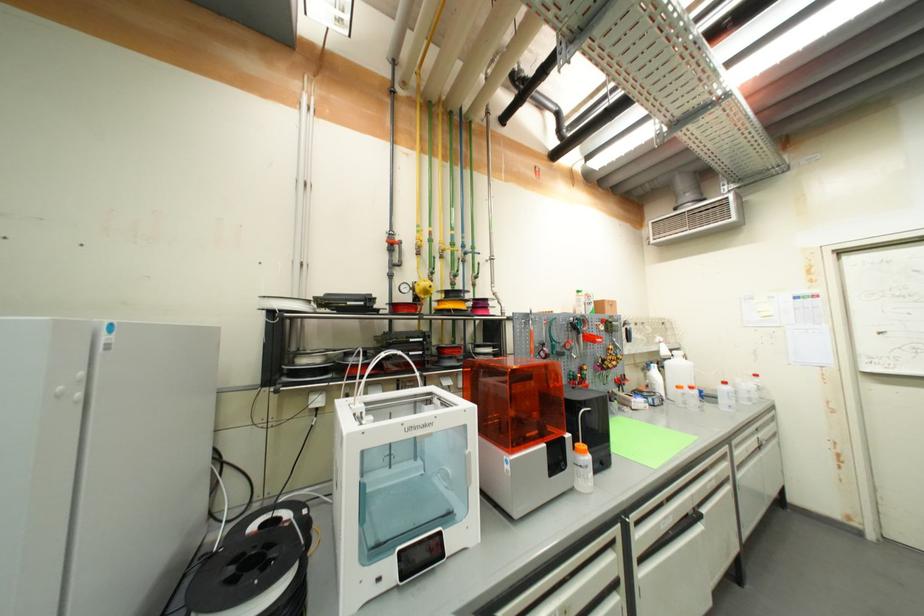
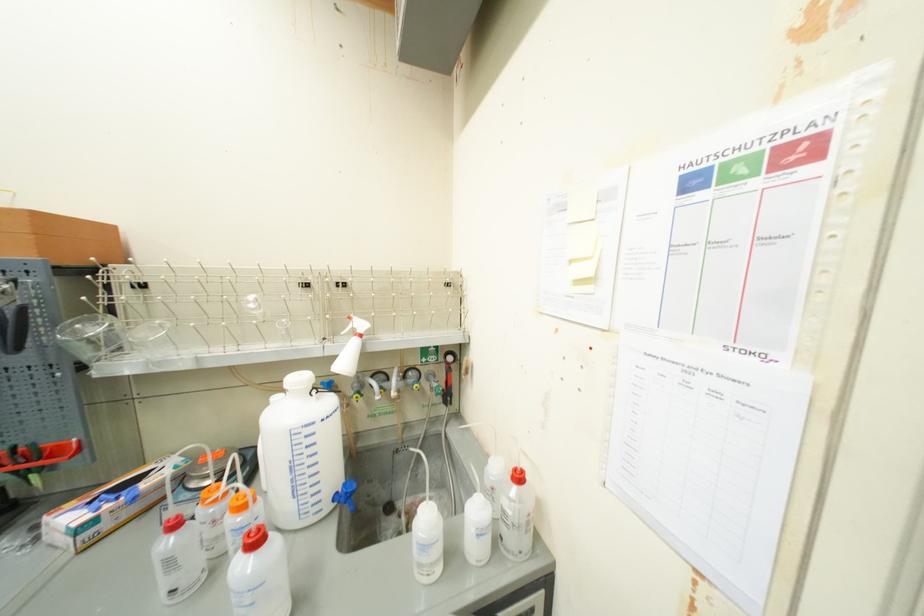
Find the pixel in the second image that matches (764,387) in the first image.

(515, 514)